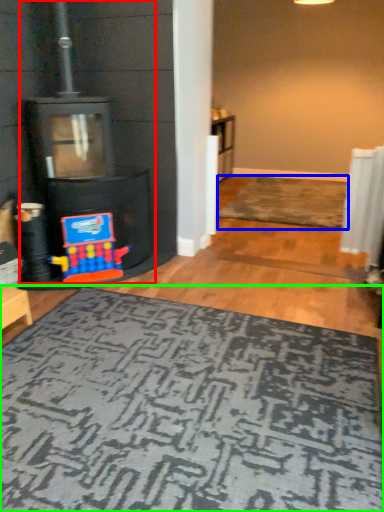
Question: Considering the real-world distances, which object is closest to fireplace (highlighted by a red box)? doormat (highlighted by a blue box) or mat (highlighted by a green box).

Choices:
 (A) doormat
 (B) mat

Answer: (B)